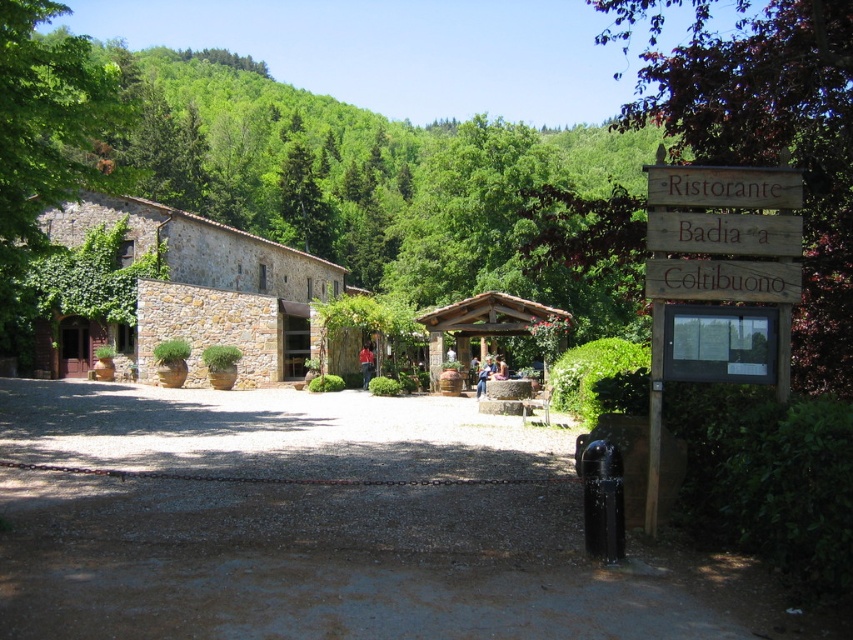
Between green leafy tree at right and wooden sign at right, which one is positioned higher?

Positioned higher is green leafy tree at right.

Is green leafy tree at right to the left of wooden sign at right from the viewer's perspective?

No, green leafy tree at right is not to the left of wooden sign at right.

Which is in front, point (849, 376) or point (660, 189)?

Point (660, 189) is in front.

Identify the location of green leafy tree at right. This screenshot has height=640, width=853. (775, 141).

Who is more distant from viewer, (236, 564) or (752, 90)?

Point (752, 90)

Does gravel driveway at center have a lesser height compared to green leafy tree at right?

Yes, gravel driveway at center is shorter than green leafy tree at right.

Does point (306, 525) lie in front of point (851, 396)?

Yes, point (306, 525) is closer to viewer.

Identify the location of gravel driveway at center. The image size is (853, 640). point(328,525).

The image size is (853, 640). Describe the element at coordinates (328, 525) in the screenshot. I see `gravel driveway at center` at that location.

Who is more forward, (544,589) or (756,192)?

Point (544,589)

Is point (461, 563) in front of point (772, 278)?

Yes, point (461, 563) is closer to viewer.

Image resolution: width=853 pixels, height=640 pixels. Find the location of `gravel driveway at center`. gravel driveway at center is located at coordinates (328, 525).